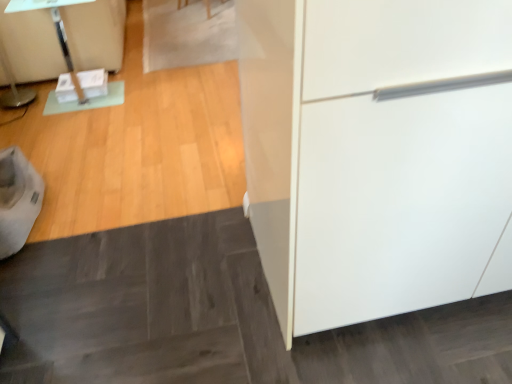
Question: Should I look upward or downward to see clear glass table at upper left?

Choices:
 (A) up
 (B) down

Answer: (A)